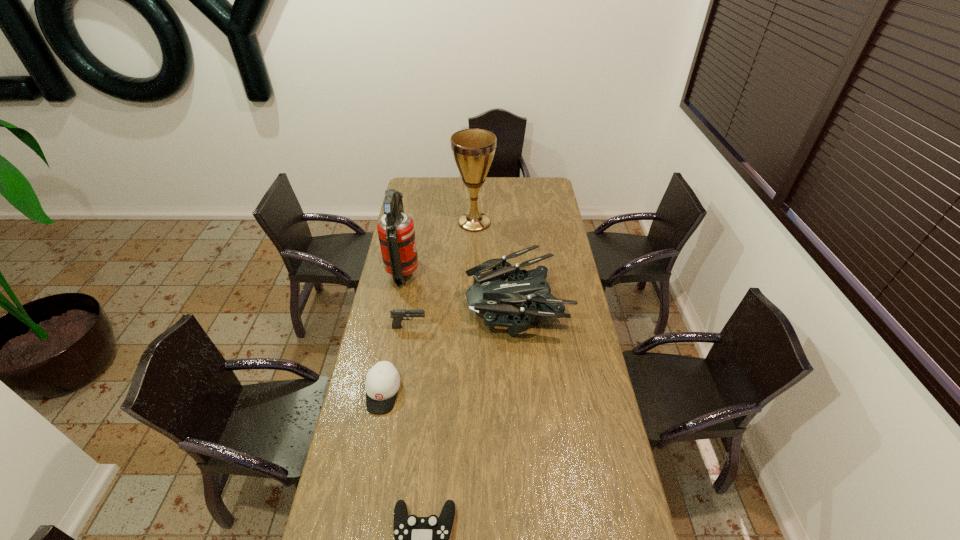
Locate an element on the screen. The height and width of the screenshot is (540, 960). trophy cup is located at coordinates (473, 150).

Image resolution: width=960 pixels, height=540 pixels. In order to click on fire extinguisher in this screenshot , I will do pos(396,233).

The height and width of the screenshot is (540, 960). Identify the location of drone. (490, 294).

This screenshot has width=960, height=540. I want to click on pistol, so click(x=397, y=314).

You are a GUI agent. You are given a task and a screenshot of the screen. Output one action in this format:
    pyautogui.click(x=<x>, y=<y>)
    Task: Click on the fifth farthest object
    This screenshot has height=540, width=960.
    Given the screenshot: What is the action you would take?
    pyautogui.click(x=382, y=383)

Find the location of a particular element. This screenshot has width=960, height=540. free region located 0.170m on the left of the farthest object is located at coordinates (423, 222).

Where is `vacant space located 0.180m on the front label side of the fire extinguisher`? Image resolution: width=960 pixels, height=540 pixels. vacant space located 0.180m on the front label side of the fire extinguisher is located at coordinates (457, 272).

Where is `vacant space located 0.080m on the back of the third tallest object`? The image size is (960, 540). vacant space located 0.080m on the back of the third tallest object is located at coordinates (513, 258).

Find the location of a particular element. The width and height of the screenshot is (960, 540). free space located aim along the barrel of the pistol is located at coordinates (461, 327).

Identify the location of vacant space located on the front-facing side of the baseball cap. This screenshot has height=540, width=960. (363, 500).